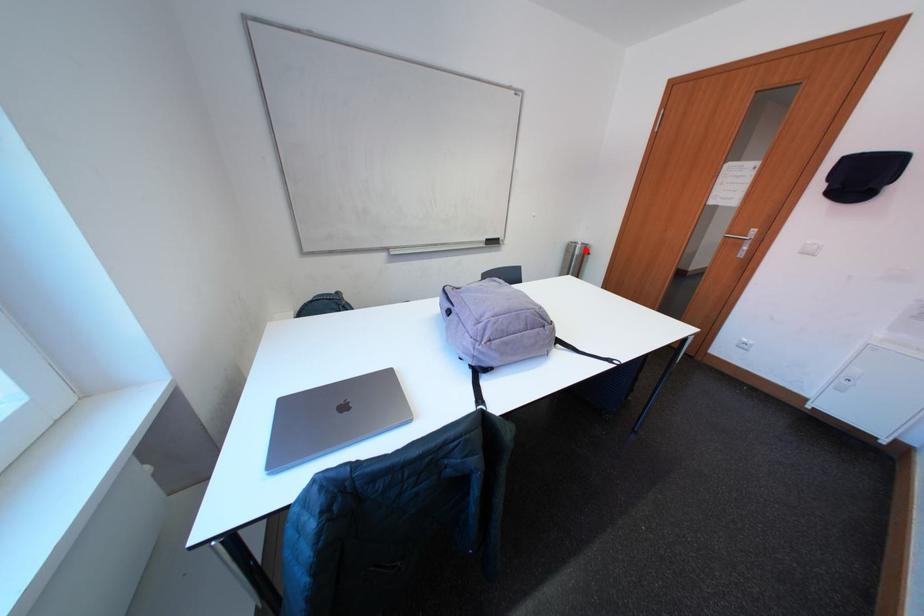
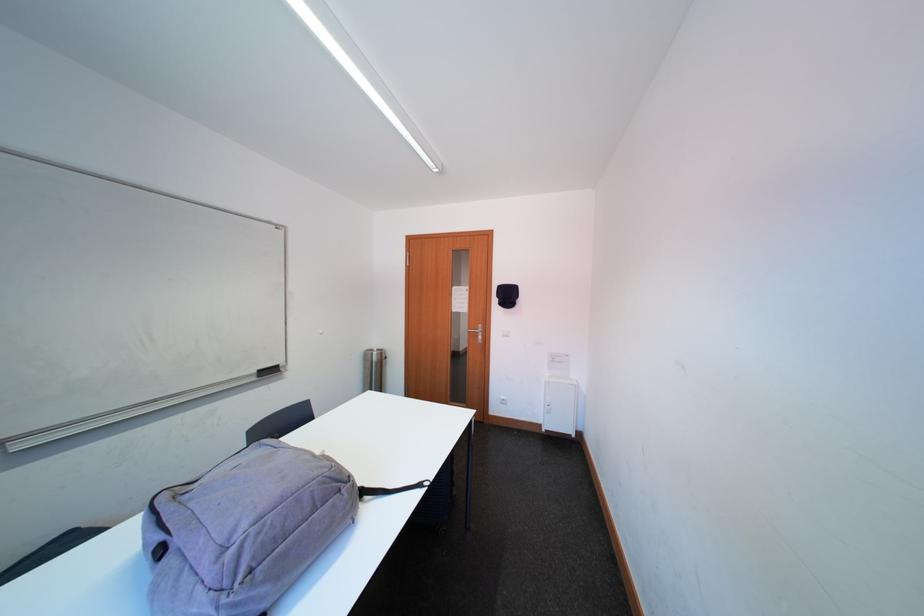
Question: I am providing you with two images of the same scene from different viewpoints. In image1, a red point is highlighted. Considering the same 3D point in image2, which of the following is correct?

Choices:
 (A) It is closer
 (B) It is farther

Answer: (B)